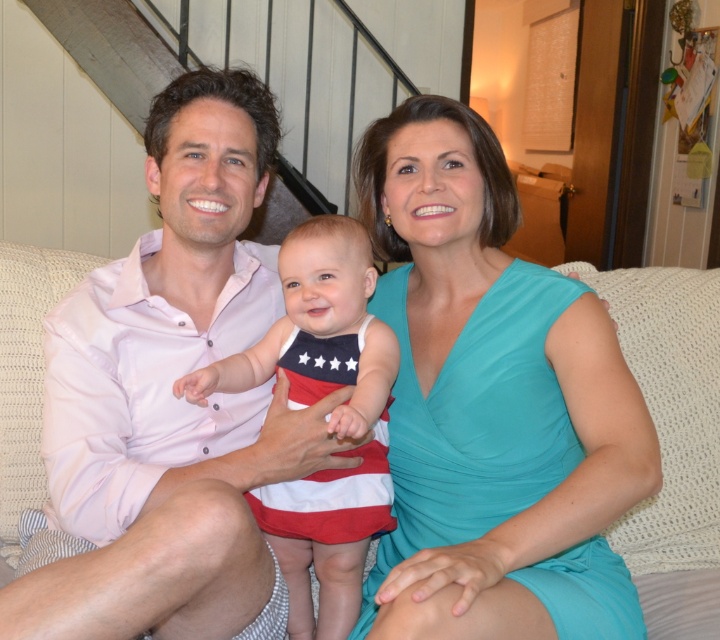
Who is lower down, pink cotton shirt at center or american flag fabric dress at center?

american flag fabric dress at center is lower down.

Locate an element on the screen. pink cotton shirt at center is located at coordinates (168, 392).

Find the location of a particular element. pink cotton shirt at center is located at coordinates (168, 392).

Does pink cotton shirt at center have a larger size compared to white woven couch at center?

Correct, pink cotton shirt at center is larger in size than white woven couch at center.

The width and height of the screenshot is (720, 640). What do you see at coordinates (168, 392) in the screenshot?
I see `pink cotton shirt at center` at bounding box center [168, 392].

Who is more distant from viewer, [216,573] or [24,369]?

Positioned behind is point [24,369].

Locate an element on the screen. The width and height of the screenshot is (720, 640). pink cotton shirt at center is located at coordinates (168, 392).

Is teal satin dress at center closer to the viewer compared to pink cotton shirt at center?

No, teal satin dress at center is behind pink cotton shirt at center.

Does teal satin dress at center have a smaller size compared to pink cotton shirt at center?

Indeed, teal satin dress at center has a smaller size compared to pink cotton shirt at center.

Image resolution: width=720 pixels, height=640 pixels. What do you see at coordinates (492, 404) in the screenshot?
I see `teal satin dress at center` at bounding box center [492, 404].

This screenshot has height=640, width=720. Find the location of `teal satin dress at center`. teal satin dress at center is located at coordinates (492, 404).